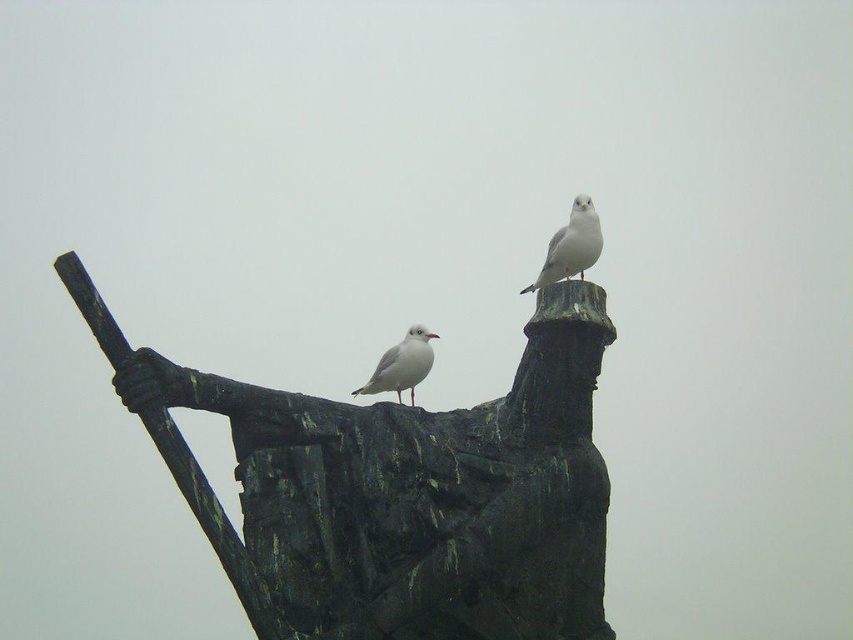
You are standing in front of the wooden structure with two seagulls. You want to place a small sticker on the point that is closer to you. Which point should you choose between point (326, 470) and point (413, 362)?

You should choose point (326, 470) because it is closer to the viewer than point (413, 362).

You are a drone operator trying to capture a photo of the green patina statue at center. Your drone has a camera with a 50mm focal length. If the statue is at coordinates 0.767 on the x axis and 0.469 on the y axis, will the statue be centered in the photo?

The green patina statue at center is located at point (399, 490), so it will be centered in the photo if the drone is positioned directly above those coordinates. However, the exact framing depends on the camera angle and zoom level. Since the statue is already at the center coordinates, adjusting the camera to focus there should center it.